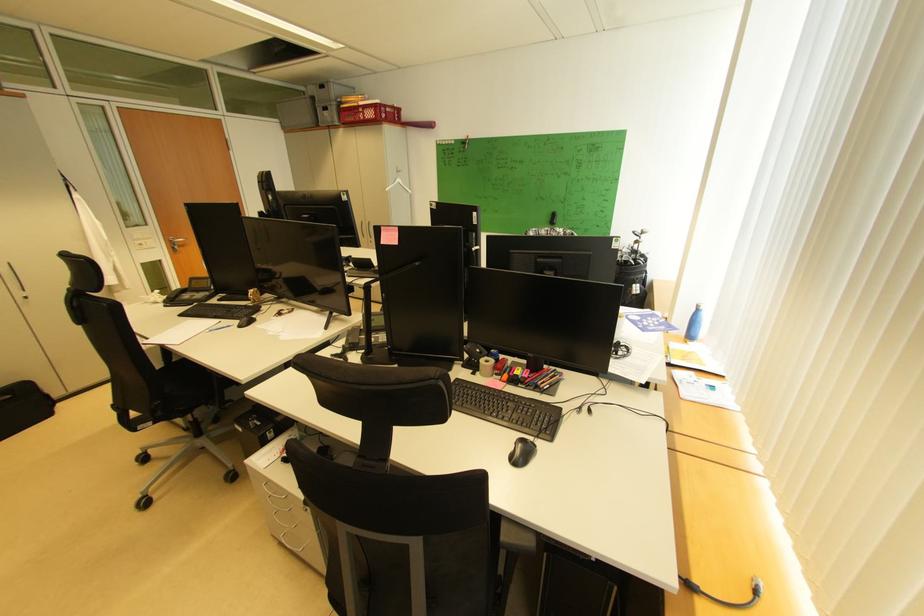
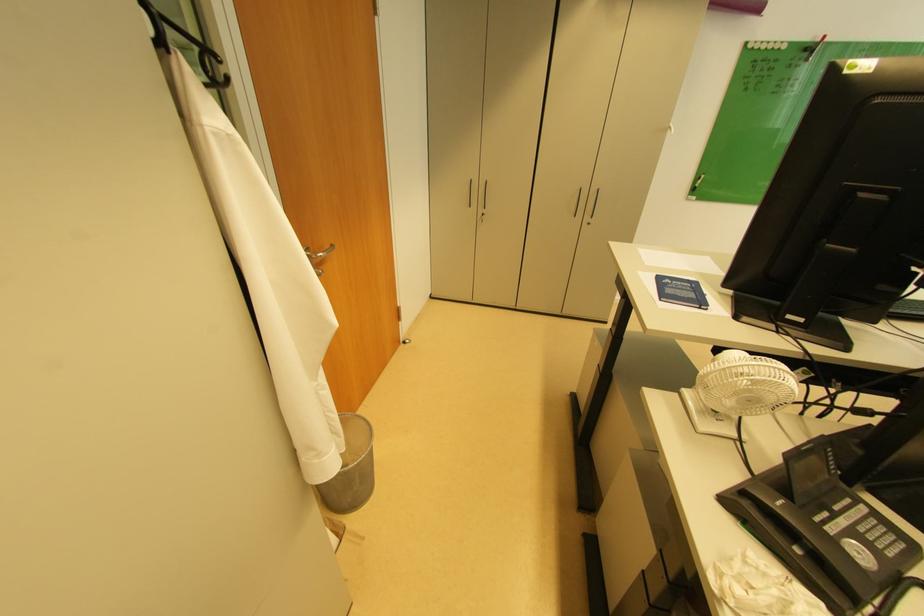
What movement of the cameraman would produce the second image?

The cameraman walked toward left, forward.